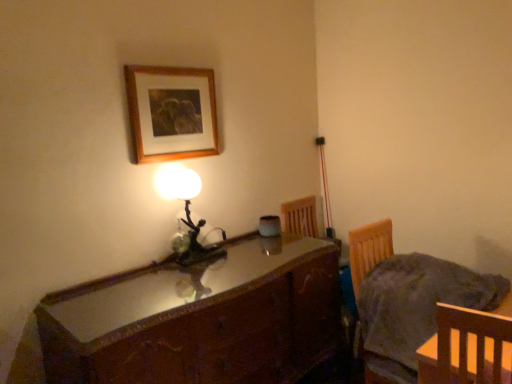
Question: From their relative heights in the image, would you say wooden picture frame at upper center is taller or shorter than wooden chair at lower right?

Choices:
 (A) tall
 (B) short

Answer: (A)

Question: Is wooden picture frame at upper center inside or outside of wooden chair at lower right?

Choices:
 (A) inside
 (B) outside

Answer: (B)

Question: Which object is positioned farthest from the matte glass lamp at center?

Choices:
 (A) wooden picture frame at upper center
 (B) shiny brown wooden desk at center
 (C) wooden chair at lower right

Answer: (C)

Question: Which is farther from the wooden picture frame at upper center?

Choices:
 (A) shiny brown wooden desk at center
 (B) matte glass lamp at center
 (C) wooden chair at lower right

Answer: (C)